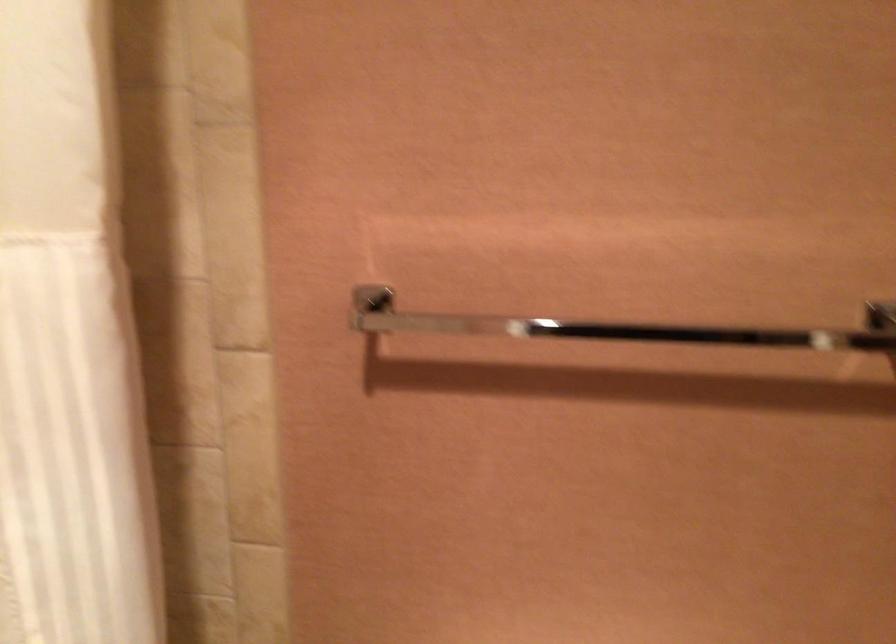
Question: The images are taken continuously from a first-person perspective. In which direction is your viewpoint rotating?

Choices:
 (A) Left
 (B) Right
 (C) Up
 (D) Down

Answer: (B)